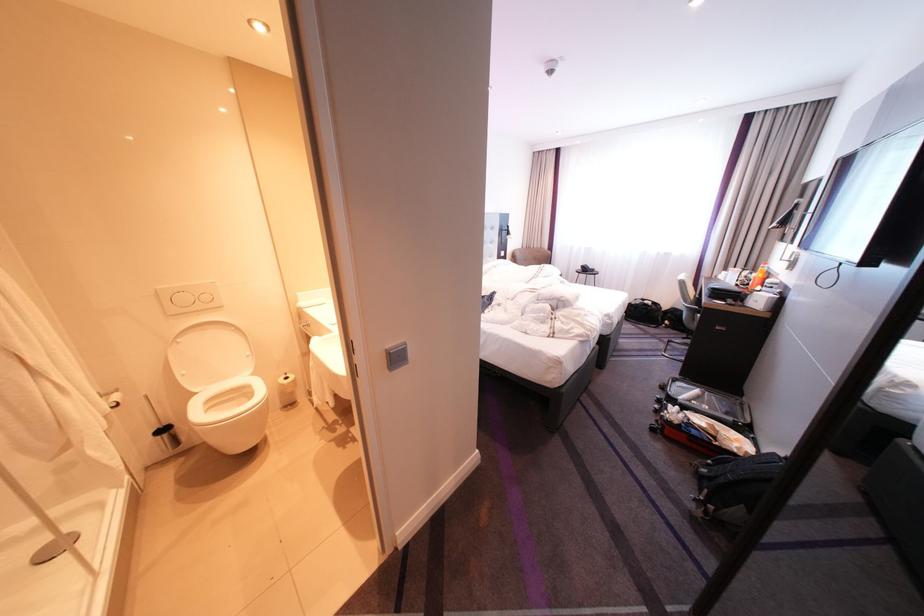
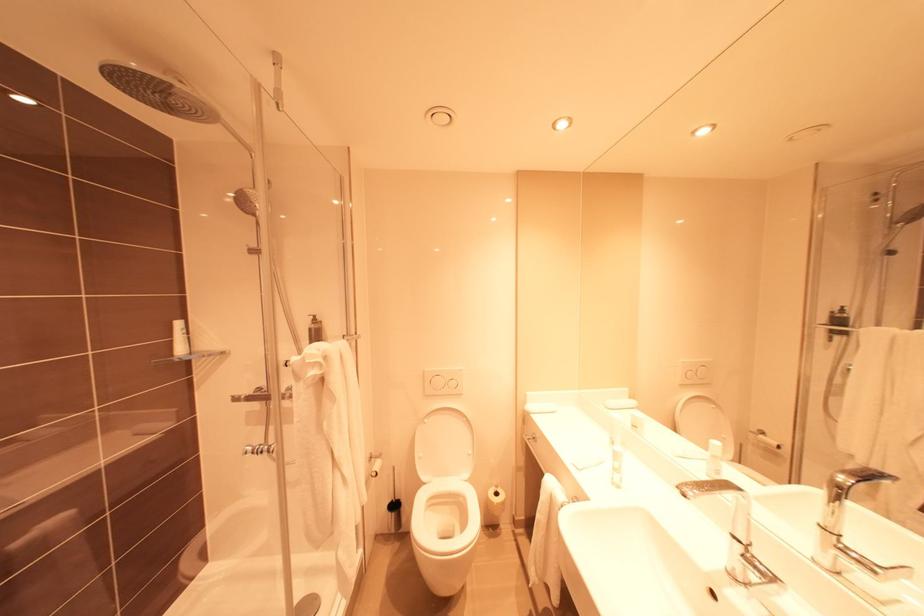
Question: Based on the continuous images, in which direction is the camera rotating? Reply with the corresponding letter.

Choices:
 (A) Left
 (B) Right
 (C) Up
 (D) Down

Answer: (A)